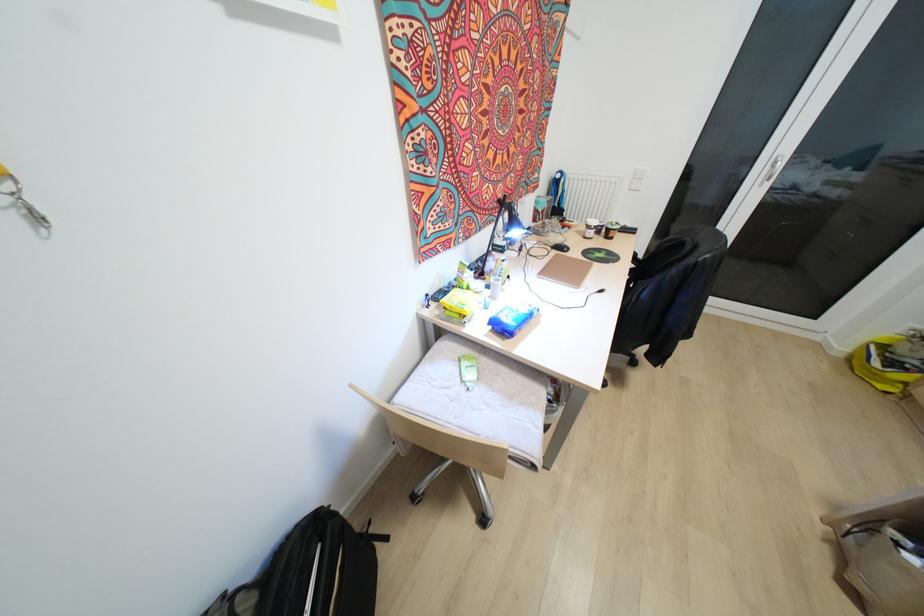
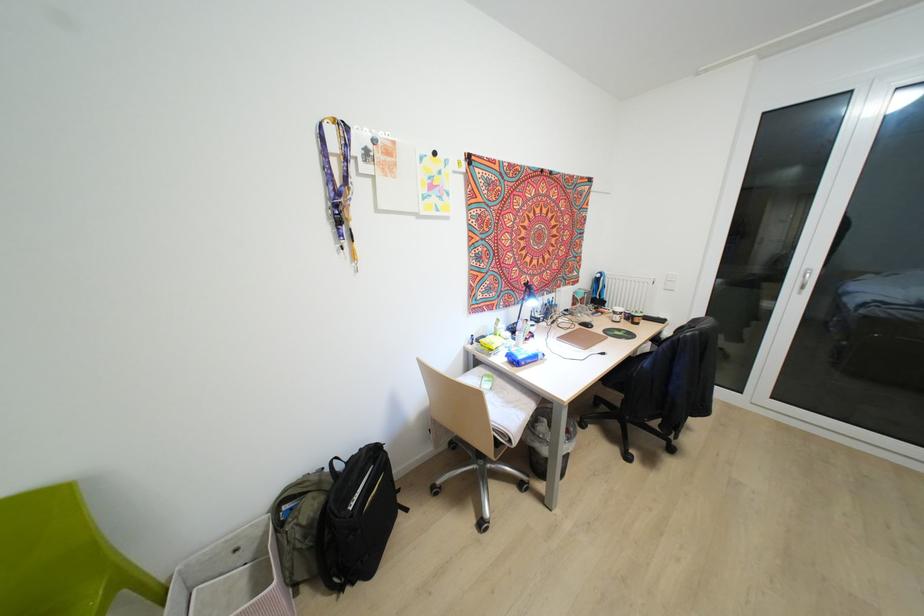
The point at (385,538) is marked in the first image. Where is the corresponding point in the second image?

(406, 509)